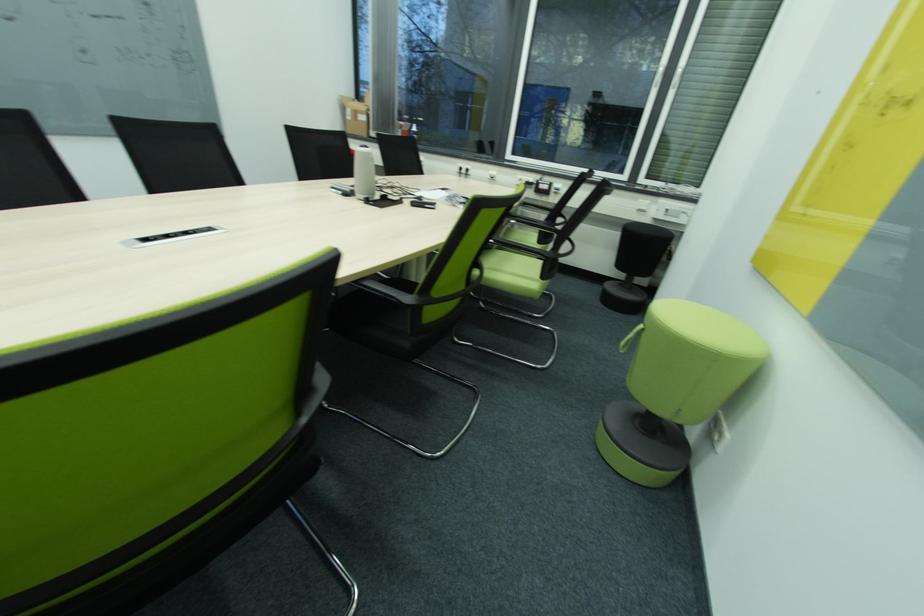
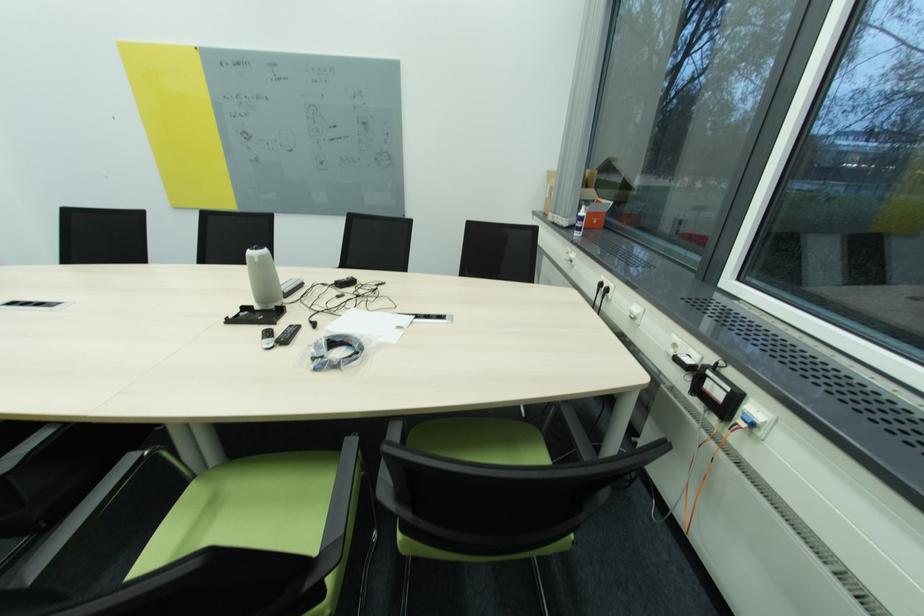
Locate, in the second image, the point that corresponds to [526,180] in the first image.

(679, 346)